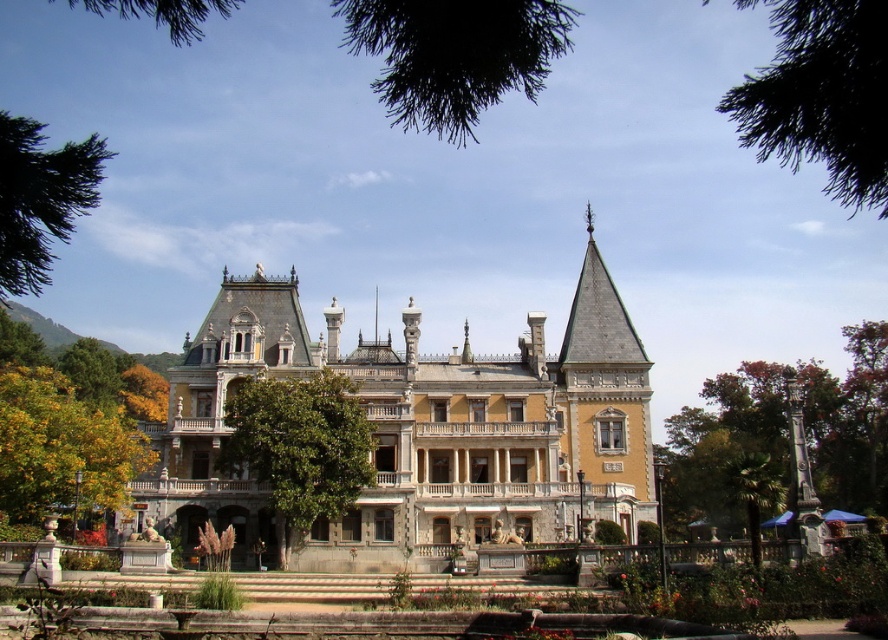
Is yellow-green leaves at lower left bigger than dark green leafy tree at upper right?

No.

Which is above, yellow-green leaves at lower left or dark green leafy tree at upper right?

dark green leafy tree at upper right is above.

This screenshot has width=888, height=640. What do you see at coordinates (69, 422) in the screenshot? I see `yellow-green leaves at lower left` at bounding box center [69, 422].

I want to click on yellow-green leaves at lower left, so click(x=69, y=422).

Is green leafy tree at right smaller than green leafy tree at upper left?

Correct, green leafy tree at right occupies less space than green leafy tree at upper left.

Is green leafy tree at right below green leafy tree at upper left?

Indeed, green leafy tree at right is positioned under green leafy tree at upper left.

Is point (752, 554) positioned in front of point (12, 230)?

That is False.

Identify the location of green leafy tree at right. (787, 438).

How far apart are yellow-green leaves at lower left and green leafy tree at center?

The distance of yellow-green leaves at lower left from green leafy tree at center is 19.43 meters.

Does yellow-green leaves at lower left have a larger size compared to green leafy tree at center?

Yes, yellow-green leaves at lower left is bigger than green leafy tree at center.

Which is in front, point (40, 500) or point (297, 442)?

Point (297, 442) is in front.

Find the location of a particular element. The image size is (888, 640). yellow-green leaves at lower left is located at coordinates (69, 422).